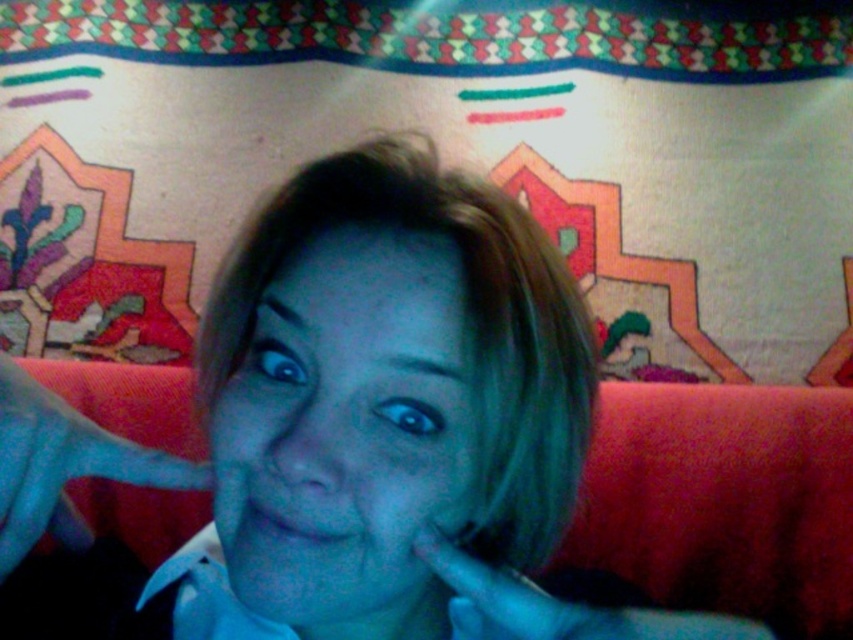
Question: Among these points, which one is farthest from the camera?

Choices:
 (A) (502, 634)
 (B) (0, 429)
 (C) (299, 392)

Answer: (C)

Question: Can you confirm if blue fabric hand at center is wider than smooth skin hand at lower right?

Choices:
 (A) yes
 (B) no

Answer: (B)

Question: Which point appears farthest from the camera in this image?

Choices:
 (A) (538, 620)
 (B) (511, 349)

Answer: (B)

Question: Which object appears closest to the camera in this image?

Choices:
 (A) blue fabric hand at center
 (B) matte blue face at center
 (C) smooth skin hand at lower right

Answer: (A)

Question: Is matte blue face at center below smooth skin hand at lower right?

Choices:
 (A) yes
 (B) no

Answer: (B)

Question: Does matte blue face at center have a lesser width compared to blue fabric hand at center?

Choices:
 (A) yes
 (B) no

Answer: (B)